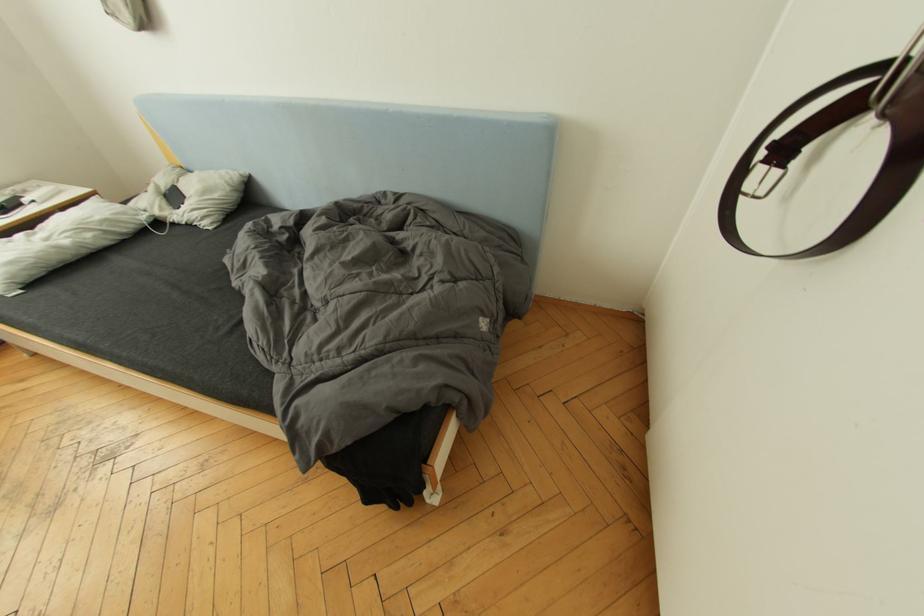
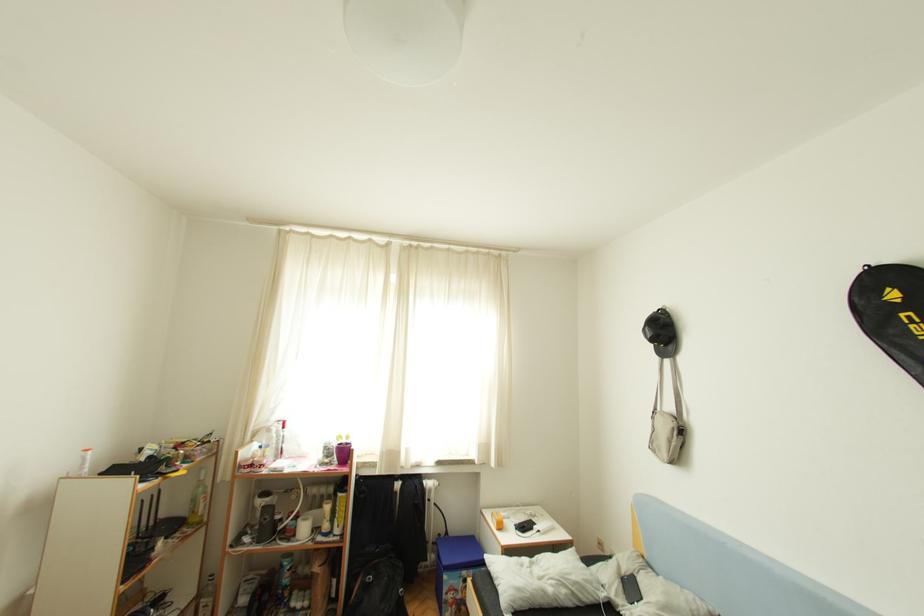
Based on the continuous images, in which direction is the camera rotating?

The camera's rotation is toward left-up.